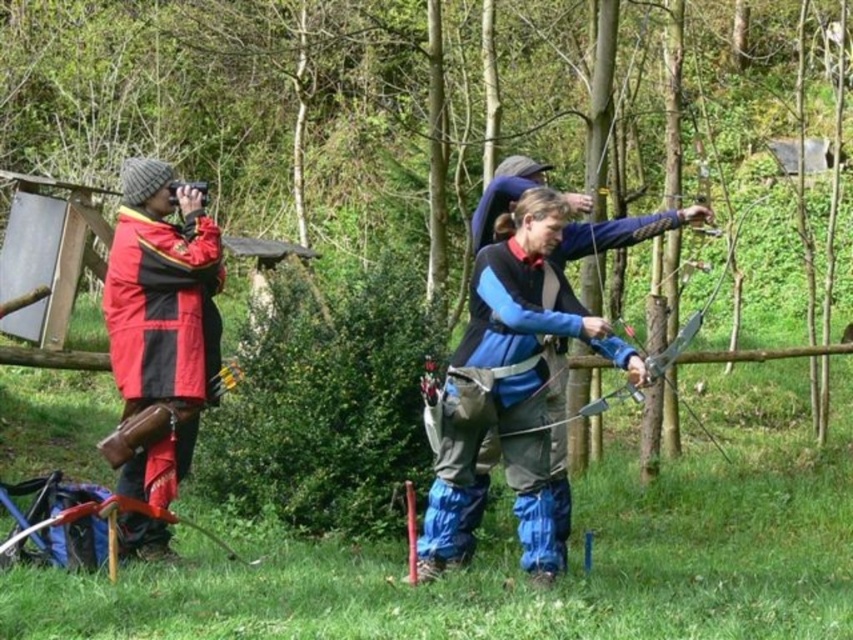
Question: Which point is closer to the camera?

Choices:
 (A) blue matte archer at center
 (B) red matte jacket at left

Answer: (A)

Question: Is blue matte archer at center wider than red matte jacket at left?

Choices:
 (A) no
 (B) yes

Answer: (B)

Question: Is blue matte archer at center positioned at the back of red matte jacket at left?

Choices:
 (A) no
 (B) yes

Answer: (A)

Question: Does blue matte archer at center have a smaller size compared to red matte jacket at left?

Choices:
 (A) yes
 (B) no

Answer: (B)

Question: Among these objects, which one is nearest to the camera?

Choices:
 (A) blue matte archer at center
 (B) red matte jacket at left

Answer: (A)

Question: Which point is farther from the camera taking this photo?

Choices:
 (A) (198, 330)
 (B) (468, 394)

Answer: (A)